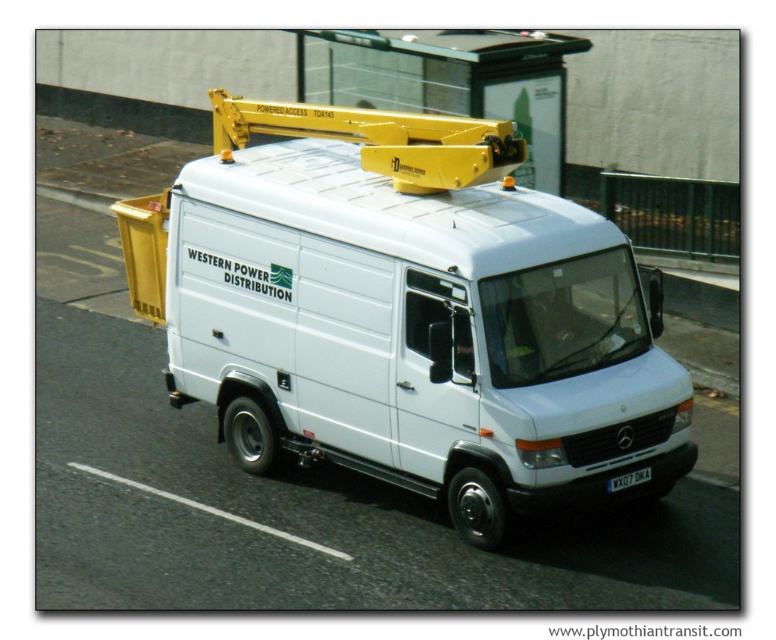
Looking at this image, you are a delivery driver who needs to check the license plate number for a delivery confirmation. You are currently looking at the white matte van at center. Can you see the black plastic license plate at center from your current position?

The white matte van at center is positioned over black plastic license plate at center, so the license plate might be blocked from view. You may need to move to a different angle to see it clearly.